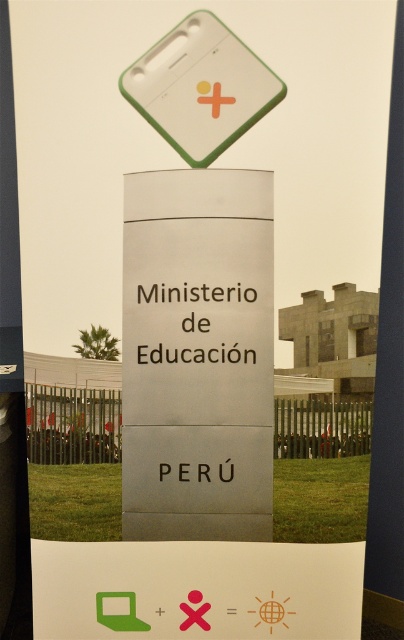
Question: Is white plastic sign at upper center wider than white smooth pole at right?

Choices:
 (A) yes
 (B) no

Answer: (A)

Question: Can you confirm if white plastic sign at upper center is positioned above white smooth pole at right?

Choices:
 (A) no
 (B) yes

Answer: (B)

Question: Is white plastic sign at upper center to the right of white smooth pole at right from the viewer's perspective?

Choices:
 (A) no
 (B) yes

Answer: (A)

Question: Which of the following is the farthest from the observer?

Choices:
 (A) (204, 52)
 (B) (401, 273)

Answer: (B)

Question: Which of the following is the farthest from the observer?

Choices:
 (A) (180, 124)
 (B) (393, 300)

Answer: (B)